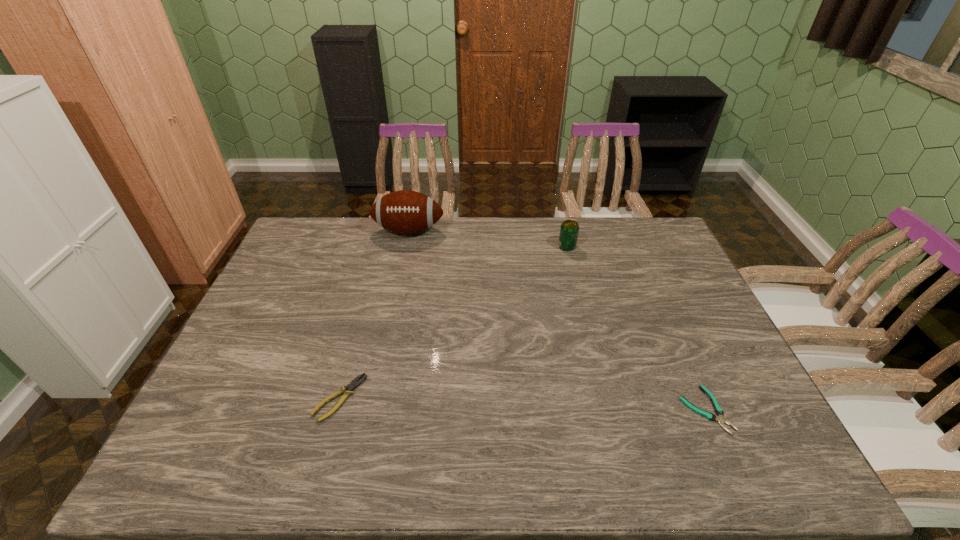
Image resolution: width=960 pixels, height=540 pixels. Identify the location of free location located on the back of the shortest object. (660, 307).

Identify the location of football situated at the far edge. (406, 212).

I want to click on beer can that is at the far edge, so click(x=569, y=229).

Identify the location of object present at the right edge. This screenshot has width=960, height=540. (720, 418).

Image resolution: width=960 pixels, height=540 pixels. In the image, there is a desktop. Find the location of `vacant space at the far edge`. vacant space at the far edge is located at coordinates (592, 240).

What are the coordinates of `free region at the near edge of the desktop` in the screenshot? It's located at (253, 451).

Where is `vacant area at the left edge of the desktop`? This screenshot has width=960, height=540. vacant area at the left edge of the desktop is located at coordinates (267, 363).

Locate an element on the screen. This screenshot has width=960, height=540. vacant region at the right edge of the desktop is located at coordinates (701, 332).

The image size is (960, 540). In order to click on vacant area at the far right corner of the desktop in this screenshot , I will do `click(663, 234)`.

This screenshot has height=540, width=960. I want to click on free spot between the tallest object and the left pliers, so pyautogui.click(x=374, y=314).